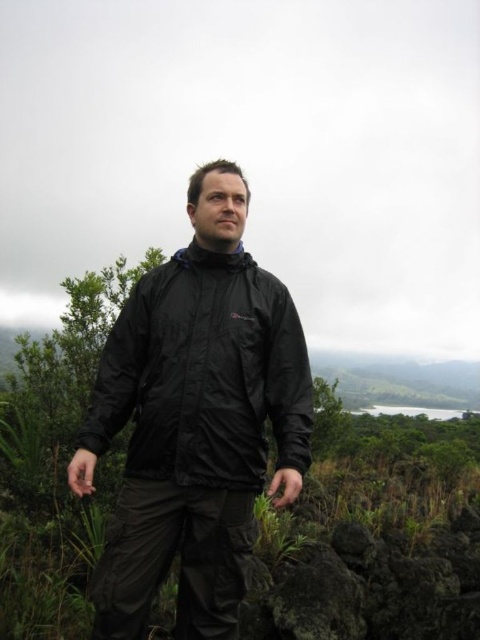
You are a hiker trying to decide whether to sit on the dark gray rough rock at lower center. Considering the black waterproof jacket at center is in your way, can you easily move it out of the way?

The black waterproof jacket at center has a greater height compared to dark gray rough rock at lower center, so it might be difficult to move the jacket out of the way since it is taller than the rock.

From the picture: You are a hiker who needs to place a small first aid kit between the green matte plant at center and the dark gray rough rock at lower center. Since the plant is above the rock, where should you place the first aid kit to ensure it is between them?

The green matte plant at center is located above the dark gray rough rock at lower center, so placing the first aid kit on the ground near the dark gray rough rock at lower center would position it between the two objects vertically.